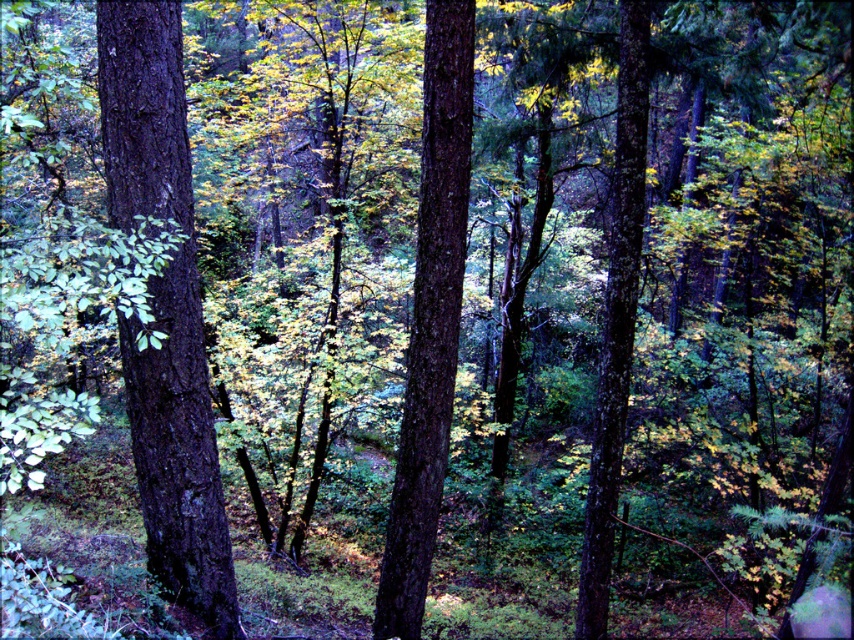
You are a hiker trying to determine the best path through the forest. You notice two trees ahead of you, the smooth dark brown tree trunk at left and the smooth bark tree at center. Which tree has a wider trunk?

The smooth bark tree at center has a wider trunk than the smooth dark brown tree trunk at left.